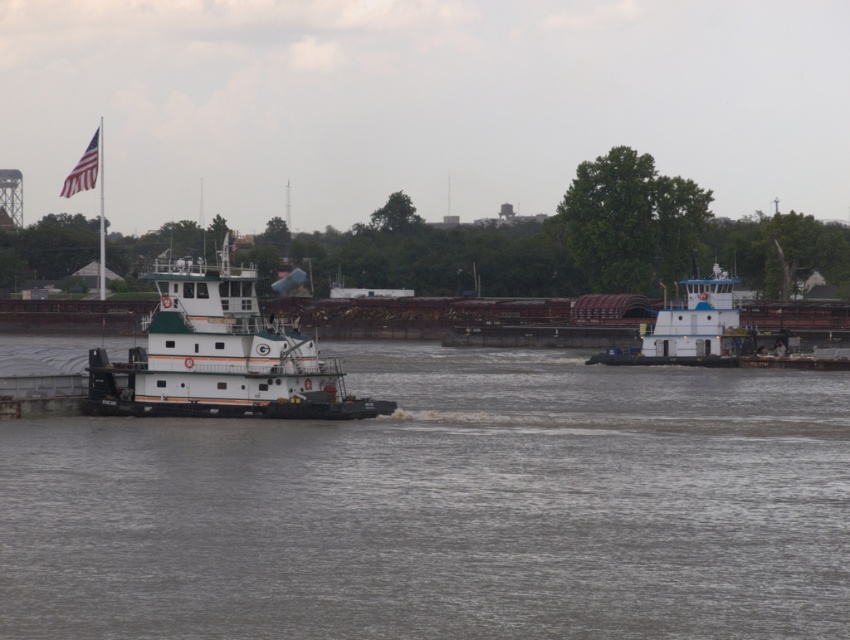
You are a GUI agent. You are given a task and a screenshot of the screen. Output one action in this format:
    pyautogui.click(x=<x>, y=<y>)
    Task: Click on the gray matte water at center
    This screenshot has height=640, width=850.
    Given the screenshot: What is the action you would take?
    pyautogui.click(x=445, y=508)

Does point (191, 582) come closer to viewer compared to point (224, 355)?

Yes.

Measure the distance between gray matte water at center and camera.

gray matte water at center is 61.45 feet from camera.

Where is `gray matte water at center`? gray matte water at center is located at coordinates (445, 508).

What do you see at coordinates (221, 356) in the screenshot?
I see `white matte tugboat at center` at bounding box center [221, 356].

Can you confirm if white matte tugboat at center is thinner than white matte tugboat at center-right?

No, white matte tugboat at center is not thinner than white matte tugboat at center-right.

Is point (246, 340) farther from viewer compared to point (735, 324)?

No, it is in front of (735, 324).

The height and width of the screenshot is (640, 850). I want to click on white matte tugboat at center, so (221, 356).

Is gray matte water at center closer to the viewer compared to white matte tugboat at center-right?

Yes, gray matte water at center is in front of white matte tugboat at center-right.

Between gray matte water at center and white matte tugboat at center-right, which one has less height?

gray matte water at center is shorter.

This screenshot has width=850, height=640. What are the coordinates of `gray matte water at center` in the screenshot? It's located at (445, 508).